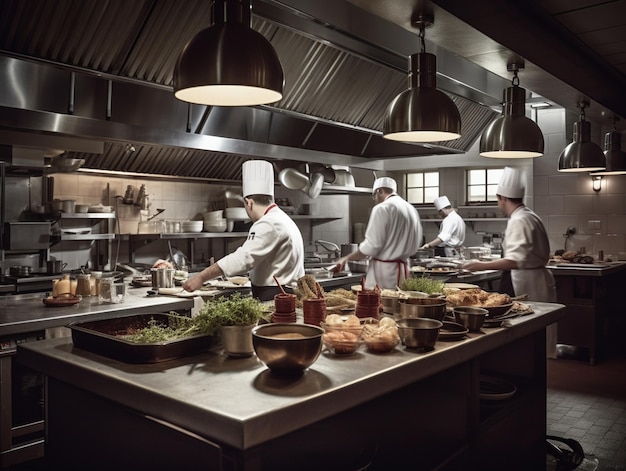
This screenshot has width=626, height=471. Find the location of `stainless steel bowl`. stainless steel bowl is located at coordinates (282, 351).